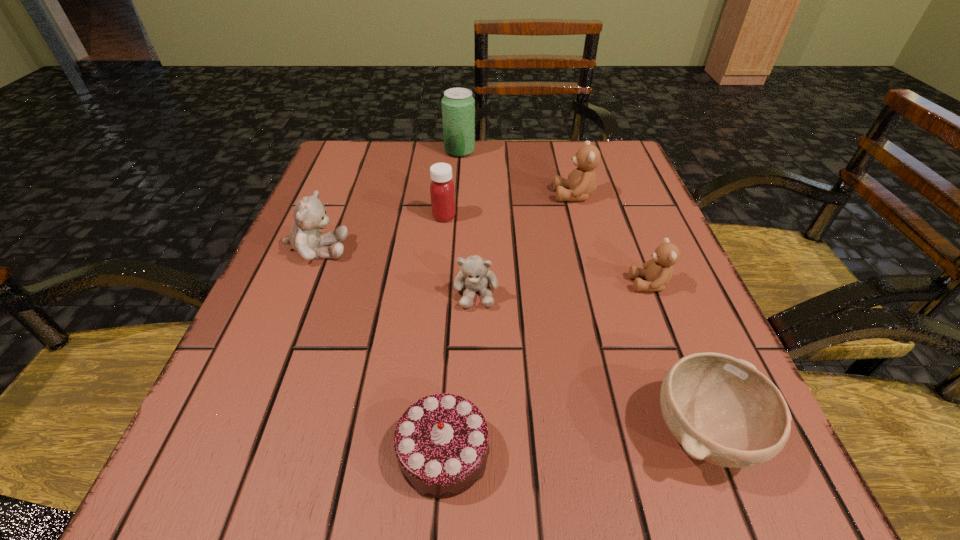
This screenshot has width=960, height=540. Identify the location of chocolate cake situated at the near edge. (441, 442).

What are the coordinates of `object present at the left edge` in the screenshot? It's located at (309, 213).

In order to click on bowl that is at the right edge in this screenshot , I will do `click(722, 410)`.

Identify the location of object that is at the far right corner. (581, 182).

I want to click on object located in the near right corner section of the desktop, so click(x=722, y=410).

The image size is (960, 540). Find the location of `vacant area at the far edge`. vacant area at the far edge is located at coordinates coord(484,183).

At what (x,y) coordinates should I click in order to perform the action: click on blank space at the near edge. Please return your answer as a coordinate pair (x, y). Looking at the image, I should click on (548, 471).

Where is `vacant space at the left edge of the desktop`? The image size is (960, 540). vacant space at the left edge of the desktop is located at coordinates (260, 351).

This screenshot has height=540, width=960. I want to click on vacant space at the right edge, so tap(697, 337).

At what (x,y) coordinates should I click in order to perform the action: click on vacant space at the far left corner of the desktop. Please return your answer as a coordinate pair (x, y). This screenshot has width=960, height=540. Looking at the image, I should click on (329, 158).